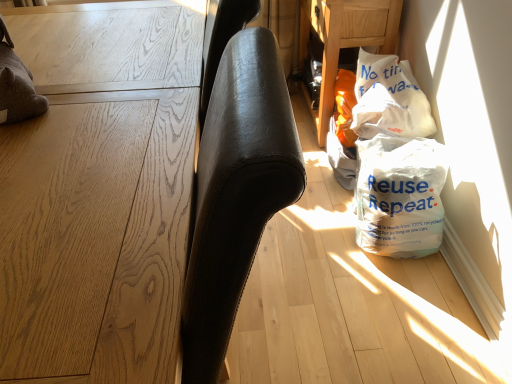
Question: Considering the relative sizes of white plastic bag at lower right, positioned as the 1th grocery bag in bottom-to-top order, and light brown wood table at left in the image provided, is white plastic bag at lower right, positioned as the 1th grocery bag in bottom-to-top order, smaller than light brown wood table at left?

Choices:
 (A) no
 (B) yes

Answer: (B)

Question: Does white plastic bag at lower right, the second grocery bag positioned from the top, have a greater height compared to light brown wood table at left?

Choices:
 (A) yes
 (B) no

Answer: (B)

Question: Is white plastic bag at lower right, the second grocery bag positioned from the top, facing away from light brown wood table at left?

Choices:
 (A) no
 (B) yes

Answer: (A)

Question: Does white plastic bag at lower right, the second grocery bag positioned from the top, have a greater width compared to light brown wood table at left?

Choices:
 (A) yes
 (B) no

Answer: (B)

Question: Could you tell me if white plastic bag at lower right, the second grocery bag positioned from the top, is facing light brown wood table at left?

Choices:
 (A) no
 (B) yes

Answer: (B)

Question: From a real-world perspective, is white plastic bag at lower right, positioned as the 1th grocery bag in bottom-to-top order, below light brown wood table at left?

Choices:
 (A) yes
 (B) no

Answer: (A)

Question: Considering the relative sizes of white plastic bag at upper right, which ranks as the 2th grocery bag in bottom-to-top order, and white plastic bag at lower right in the image provided, is white plastic bag at upper right, which ranks as the 2th grocery bag in bottom-to-top order, wider than white plastic bag at lower right?

Choices:
 (A) no
 (B) yes

Answer: (A)

Question: From a real-world perspective, does white plastic bag at upper right, which appears as the first grocery bag when viewed from the top, sit lower than white plastic bag at lower right?

Choices:
 (A) no
 (B) yes

Answer: (A)

Question: Is white plastic bag at upper right, which ranks as the 2th grocery bag in bottom-to-top order, not inside white plastic bag at lower right?

Choices:
 (A) no
 (B) yes

Answer: (B)

Question: Is white plastic bag at upper right, which ranks as the 2th grocery bag in bottom-to-top order, shorter than white plastic bag at lower right?

Choices:
 (A) yes
 (B) no

Answer: (A)

Question: From a real-world perspective, does white plastic bag at upper right, which appears as the first grocery bag when viewed from the top, stand above white plastic bag at lower right?

Choices:
 (A) no
 (B) yes

Answer: (B)

Question: From the image's perspective, is white plastic bag at upper right, which ranks as the 2th grocery bag in bottom-to-top order, under white plastic bag at lower right?

Choices:
 (A) no
 (B) yes

Answer: (B)

Question: Is white plastic bag at lower right, the second grocery bag positioned from the top, at the back of white plastic bag at lower right?

Choices:
 (A) no
 (B) yes

Answer: (A)